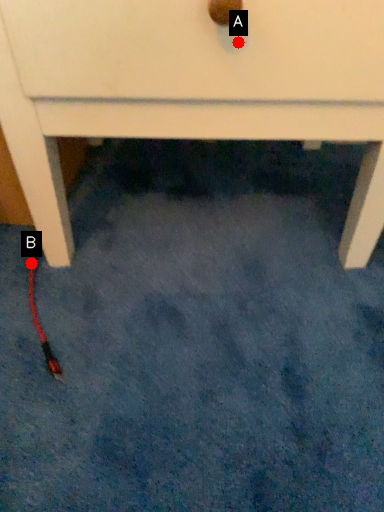
Question: Two points are circled on the image, labeled by A and B beside each circle. Which point is further to the camera?

Choices:
 (A) A is further
 (B) B is further

Answer: (B)